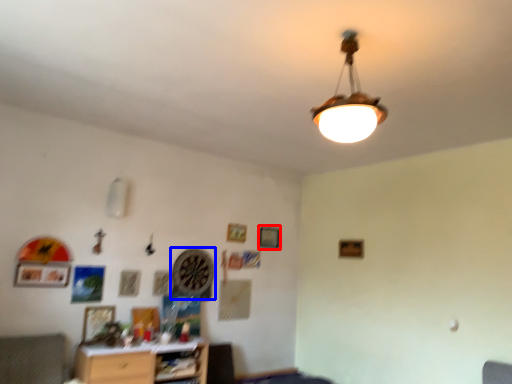
Question: Which object is closer to the camera taking this photo, picture frame (highlighted by a red box) or clock (highlighted by a blue box)?

Choices:
 (A) picture frame
 (B) clock

Answer: (B)